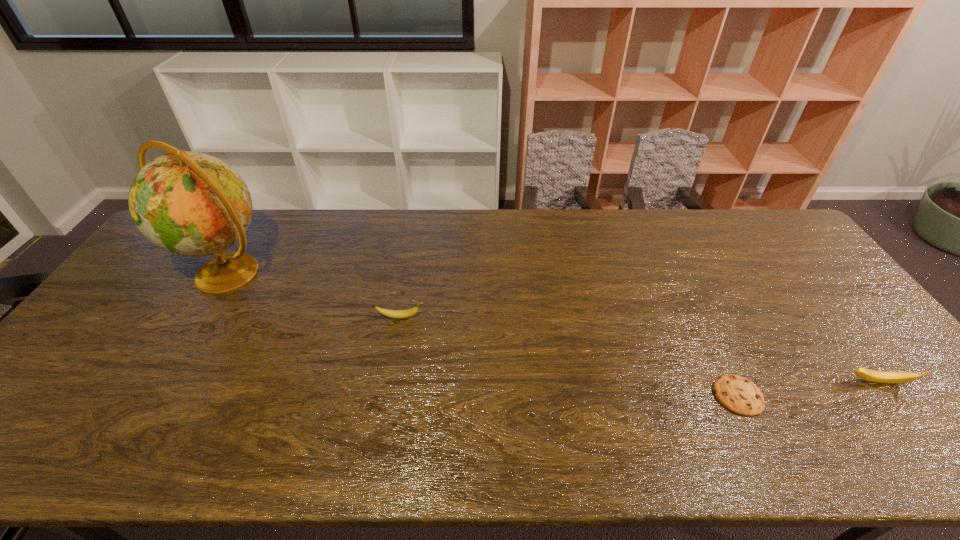
The width and height of the screenshot is (960, 540). I want to click on vacant position located 0.090m at the stem of the nearer banana, so click(909, 423).

Locate an element on the screen. The width and height of the screenshot is (960, 540). free space located 0.360m on the right of the cookie is located at coordinates (911, 395).

Identify the location of object present at the far edge. (191, 204).

What are the coordinates of `object located in the left edge section of the desktop` in the screenshot? It's located at (191, 204).

Where is `object located in the right edge section of the desktop`? object located in the right edge section of the desktop is located at coordinates (868, 375).

Locate an element on the screen. object at the far left corner is located at coordinates (191, 204).

Find the location of a particular element. The height and width of the screenshot is (540, 960). vacant area at the far edge is located at coordinates (324, 211).

Where is `free space at the near edge`? This screenshot has height=540, width=960. free space at the near edge is located at coordinates (841, 444).

The width and height of the screenshot is (960, 540). I want to click on vacant space at the right edge of the desktop, so click(888, 413).

Find the location of a particular element. vacant space at the far right corner of the desktop is located at coordinates (726, 211).